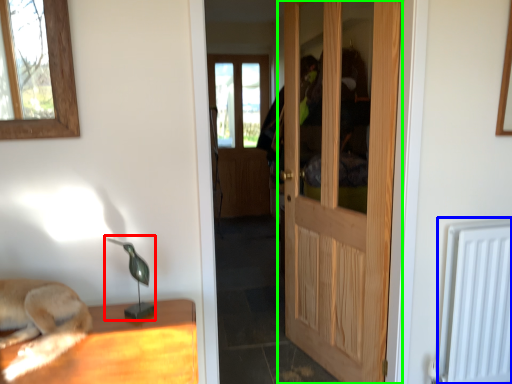
Question: Estimate the real-world distances between objects in this image. Which object is closer to table lamp (highlighted by a red box), radiator (highlighted by a blue box) or door (highlighted by a green box)?

Choices:
 (A) radiator
 (B) door

Answer: (B)